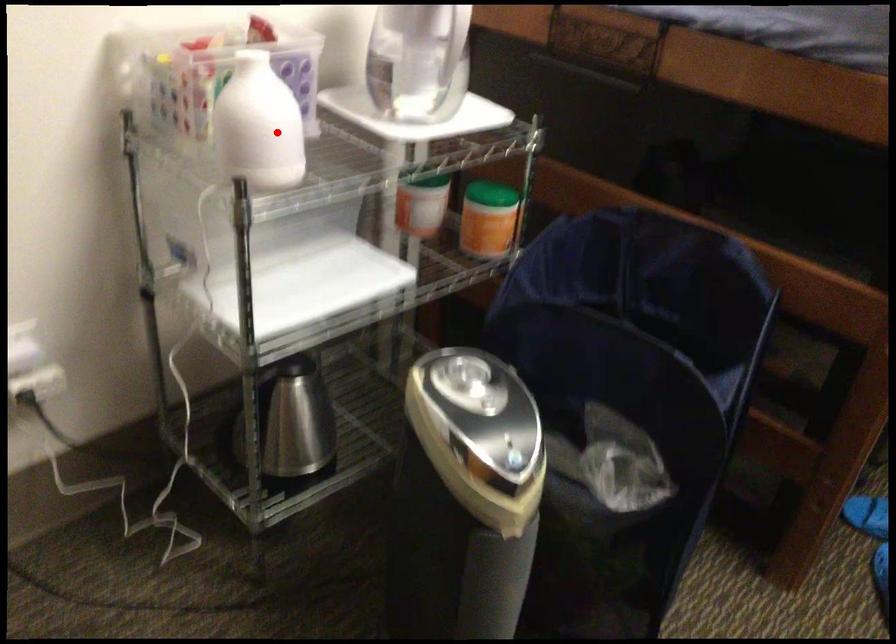
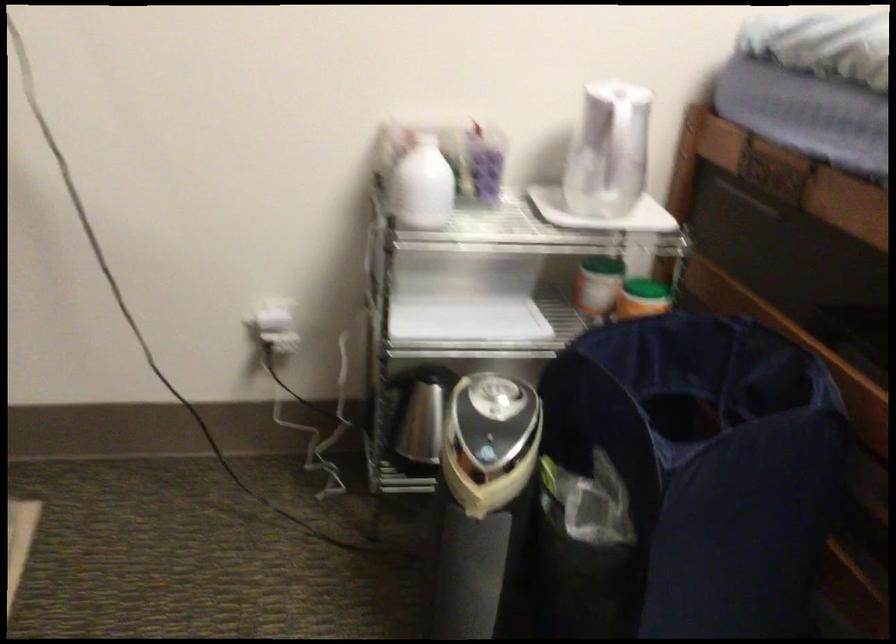
Where in the second image is the point corresponding to the highlighted location from the first image?

(421, 185)